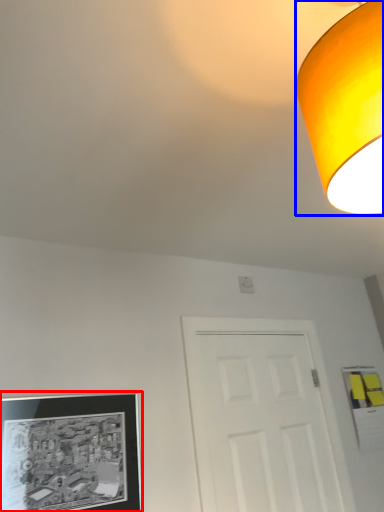
Question: Among these objects, which one is nearest to the camera, picture frame (highlighted by a red box) or lamp (highlighted by a blue box)?

Choices:
 (A) picture frame
 (B) lamp

Answer: (B)